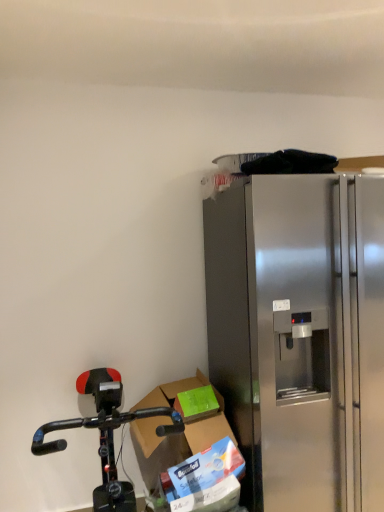
Question: Are stainless steel refrigerator at right and cardboard box at lower center located far from each other?

Choices:
 (A) no
 (B) yes

Answer: (A)

Question: From a real-world perspective, is stainless steel refrigerator at right on top of cardboard box at lower center?

Choices:
 (A) yes
 (B) no

Answer: (A)

Question: Is stainless steel refrigerator at right smaller than cardboard box at lower center?

Choices:
 (A) yes
 (B) no

Answer: (B)

Question: Is stainless steel refrigerator at right further to the viewer compared to cardboard box at lower center?

Choices:
 (A) no
 (B) yes

Answer: (A)

Question: Can you confirm if stainless steel refrigerator at right is wider than cardboard box at lower center?

Choices:
 (A) no
 (B) yes

Answer: (B)

Question: From the image's perspective, is stainless steel refrigerator at right below cardboard box at lower center?

Choices:
 (A) no
 (B) yes

Answer: (A)

Question: Is the depth of stainless steel refrigerator at right greater than that of black matte bicycle at lower left?

Choices:
 (A) yes
 (B) no

Answer: (A)

Question: Is stainless steel refrigerator at right at the right side of black matte bicycle at lower left?

Choices:
 (A) yes
 (B) no

Answer: (A)

Question: From a real-world perspective, does stainless steel refrigerator at right stand above black matte bicycle at lower left?

Choices:
 (A) no
 (B) yes

Answer: (B)

Question: Is stainless steel refrigerator at right next to black matte bicycle at lower left?

Choices:
 (A) yes
 (B) no

Answer: (B)

Question: Does stainless steel refrigerator at right have a greater height compared to black matte bicycle at lower left?

Choices:
 (A) yes
 (B) no

Answer: (A)

Question: Is stainless steel refrigerator at right positioned beyond the bounds of black matte bicycle at lower left?

Choices:
 (A) yes
 (B) no

Answer: (A)

Question: Is black matte bicycle at lower left bigger than stainless steel refrigerator at right?

Choices:
 (A) no
 (B) yes

Answer: (A)